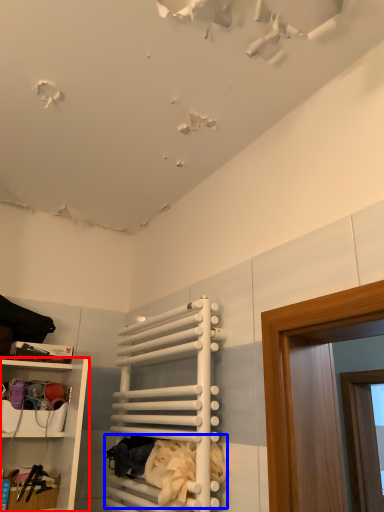
Question: Among these objects, which one is nearest to the camera, shelf (highlighted by a red box) or laundry (highlighted by a blue box)?

Choices:
 (A) shelf
 (B) laundry

Answer: (B)